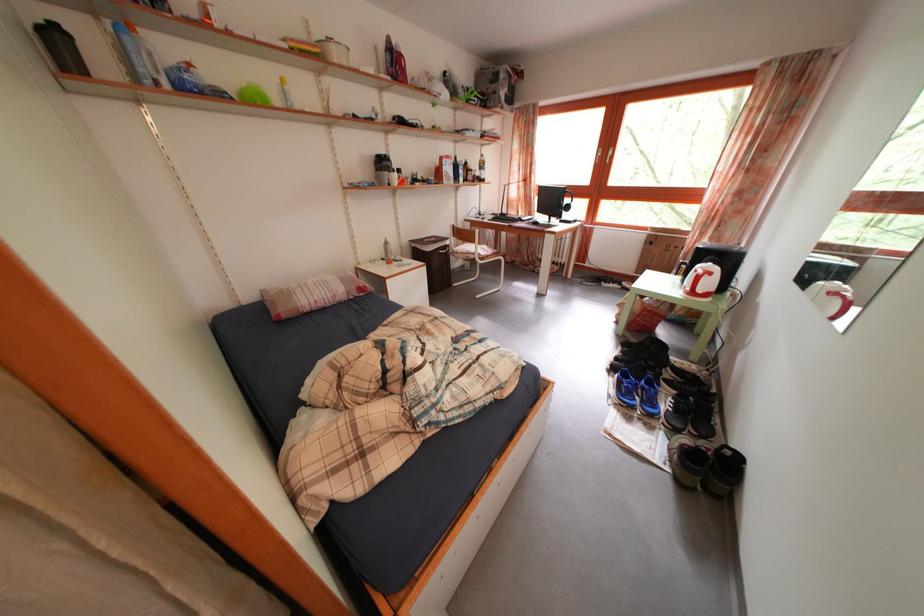
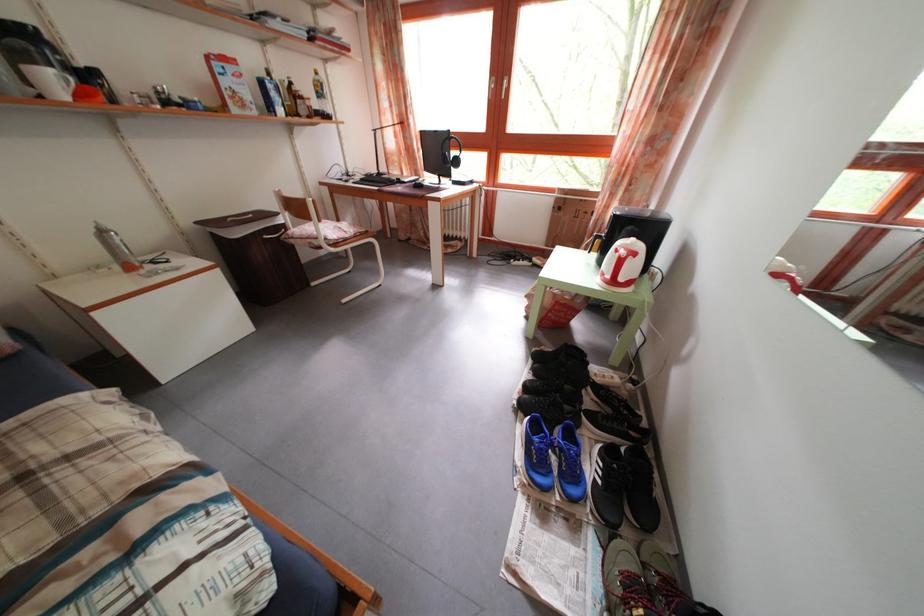
In the second image, find the point that corresponds to point (394, 251) in the first image.

(108, 238)